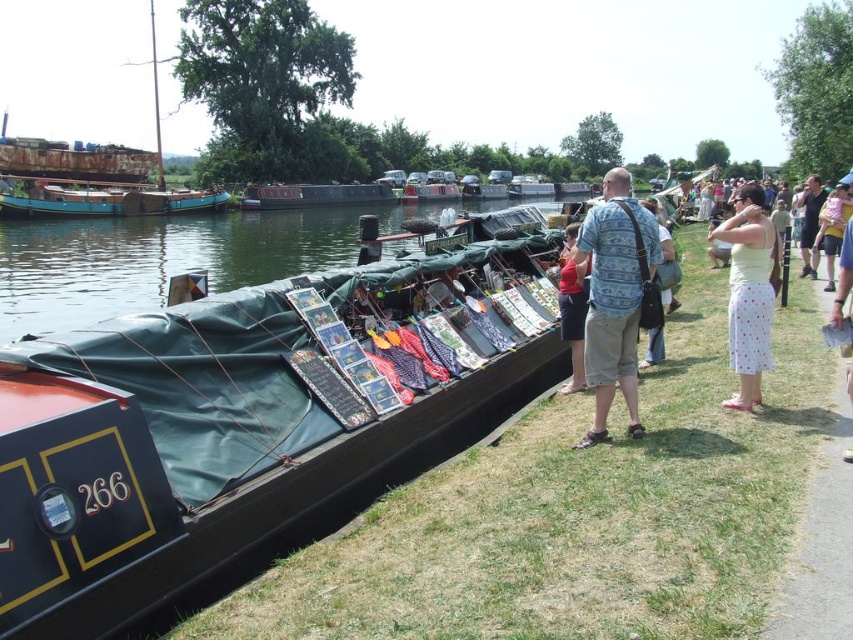
You are a visitor at the canal market. You see the green canvas boat at center and the blue fabric bag at center. Which object is closer to you?

The green canvas boat at center is closer to you because it is positioned in front of the blue fabric bag at center.

You are standing on the grassy area beside the water at the canal market. You see two points marked on the boat. The first point is at coordinates point (517,348) and the second is at point (654,216). If you want to reach the point that is closer to you, which coordinate should you aim for?

The point at (517,348) is in front of the point at (654,216), so it is closer to you. Therefore, you should aim for point (517,348).

Based on the photo, you are a vendor on the green canvas boat at center. You want to place a new item on the blue fabric bag at center. Will the item fit if it is 1 meter long?

The green canvas boat at center is shorter than the blue fabric bag at center. Therefore, the item that is 1 meter long may not fit on the blue fabric bag at center if the bag is shorter than 1 meter. However, since the boat is shorter than the bag, the bag might be longer than the boat. Without knowing the exact dimensions of the bag, it is uncertain if the item will fit.